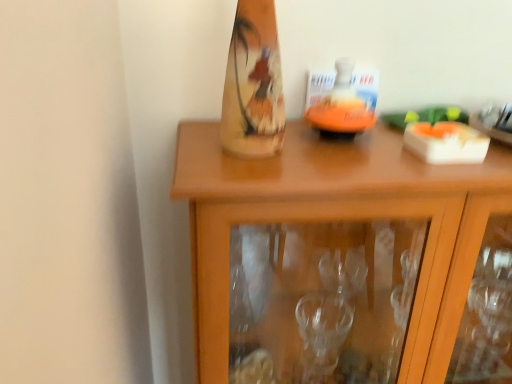
Locate an element on the screen. The image size is (512, 384). free space above wooden cabinet at center (from a real-world perspective) is located at coordinates (356, 150).